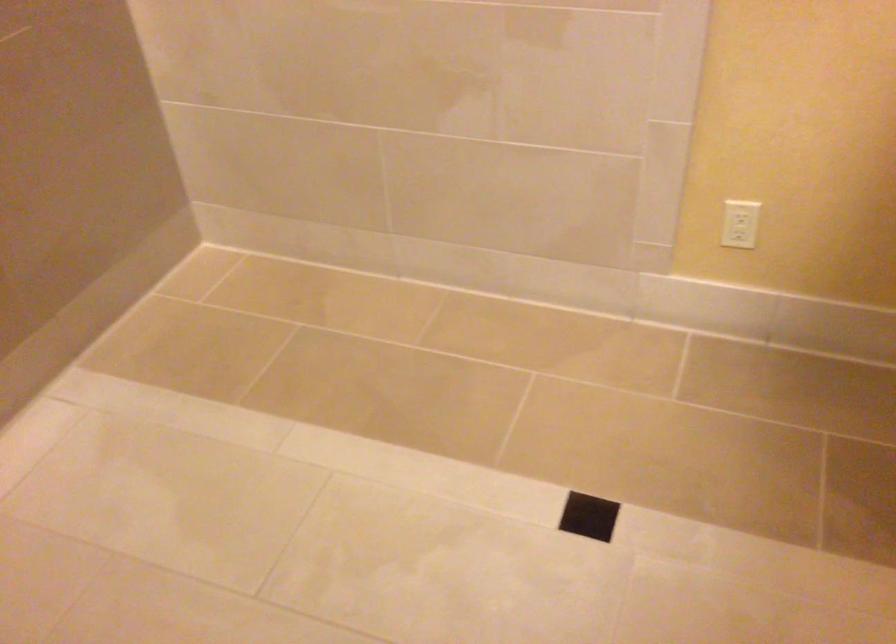
This screenshot has width=896, height=644. Describe the element at coordinates (739, 223) in the screenshot. I see `the electrical outlet socket` at that location.